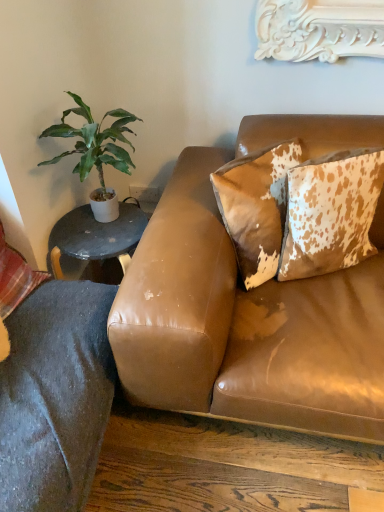
Question: Is green leafy plant at left outside of brown textured pillow at upper right, which appears as the 2th pillow when viewed from the left?

Choices:
 (A) yes
 (B) no

Answer: (A)

Question: Is the depth of green leafy plant at left less than that of brown textured pillow at upper right, which is counted as the second pillow, starting from the right?

Choices:
 (A) yes
 (B) no

Answer: (B)

Question: Would you consider green leafy plant at left to be distant from brown textured pillow at upper right, which appears as the 2th pillow when viewed from the left?

Choices:
 (A) no
 (B) yes

Answer: (A)

Question: Can you confirm if green leafy plant at left is bigger than brown textured pillow at upper right, which appears as the 2th pillow when viewed from the left?

Choices:
 (A) yes
 (B) no

Answer: (A)

Question: From the image's perspective, would you say green leafy plant at left is shown under brown textured pillow at upper right, which appears as the 2th pillow when viewed from the left?

Choices:
 (A) yes
 (B) no

Answer: (B)

Question: Considering the relative sizes of green leafy plant at left and brown textured pillow at upper right, which is counted as the second pillow, starting from the right, in the image provided, is green leafy plant at left wider than brown textured pillow at upper right, which is counted as the second pillow, starting from the right,?

Choices:
 (A) yes
 (B) no

Answer: (A)

Question: Is plaid fabric pillow at lower left, which is the 3th pillow from right to left, at the back of green leafy plant at left?

Choices:
 (A) yes
 (B) no

Answer: (B)

Question: Does green leafy plant at left have a lesser width compared to plaid fabric pillow at lower left, which is counted as the first pillow, starting from the left?

Choices:
 (A) no
 (B) yes

Answer: (A)

Question: Is green leafy plant at left facing towards plaid fabric pillow at lower left, which is counted as the first pillow, starting from the left?

Choices:
 (A) no
 (B) yes

Answer: (A)

Question: Is green leafy plant at left at the left side of plaid fabric pillow at lower left, which is the 3th pillow from right to left?

Choices:
 (A) no
 (B) yes

Answer: (A)

Question: Does green leafy plant at left lie behind plaid fabric pillow at lower left, which is counted as the first pillow, starting from the left?

Choices:
 (A) yes
 (B) no

Answer: (A)

Question: From a real-world perspective, is green leafy plant at left physically below plaid fabric pillow at lower left, which is the 3th pillow from right to left?

Choices:
 (A) no
 (B) yes

Answer: (A)

Question: Is brown textured pillow at upper right, which is counted as the second pillow, starting from the right, taller than green leafy plant at left?

Choices:
 (A) yes
 (B) no

Answer: (B)